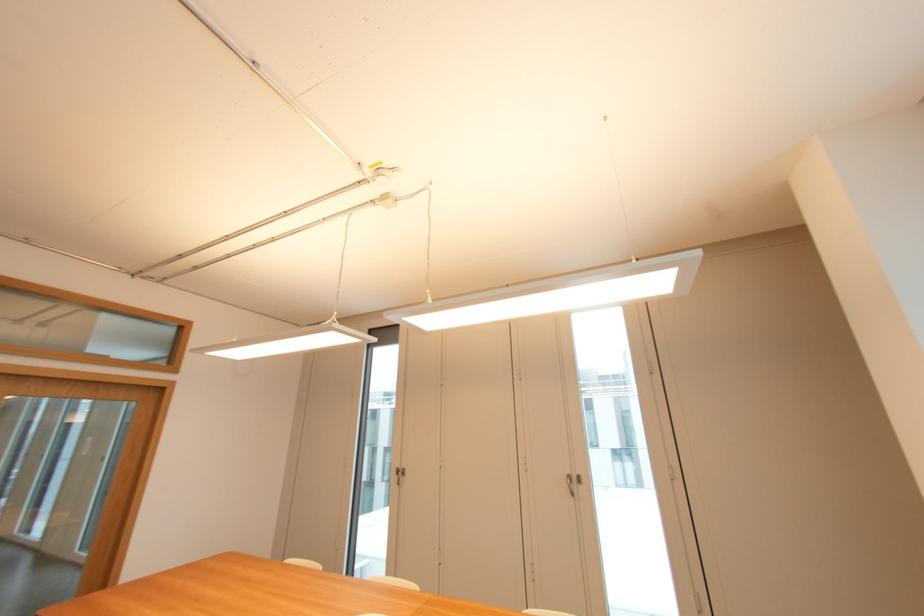
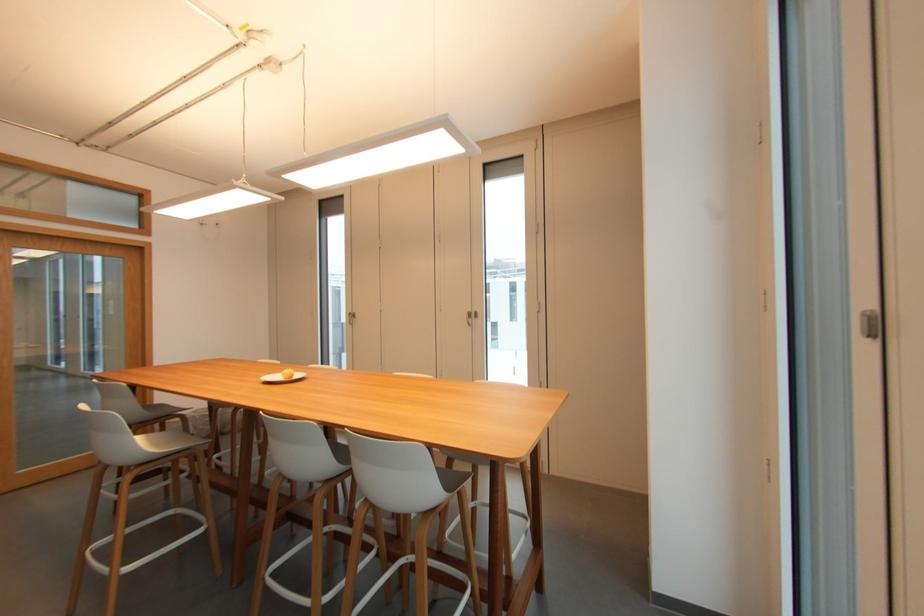
Locate, in the second image, the point that corresponds to (574,472) in the first image.

(473, 310)